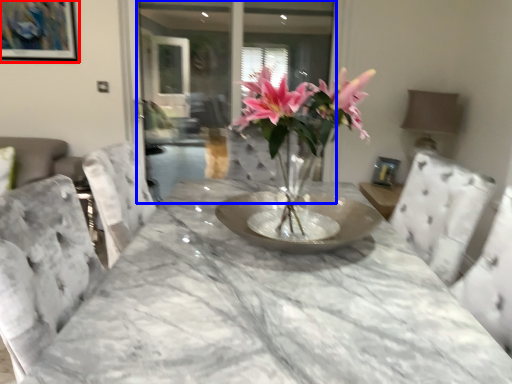
Question: Which point is further to the camera, picture frame (highlighted by a red box) or glass door (highlighted by a blue box)?

Choices:
 (A) picture frame
 (B) glass door

Answer: (B)